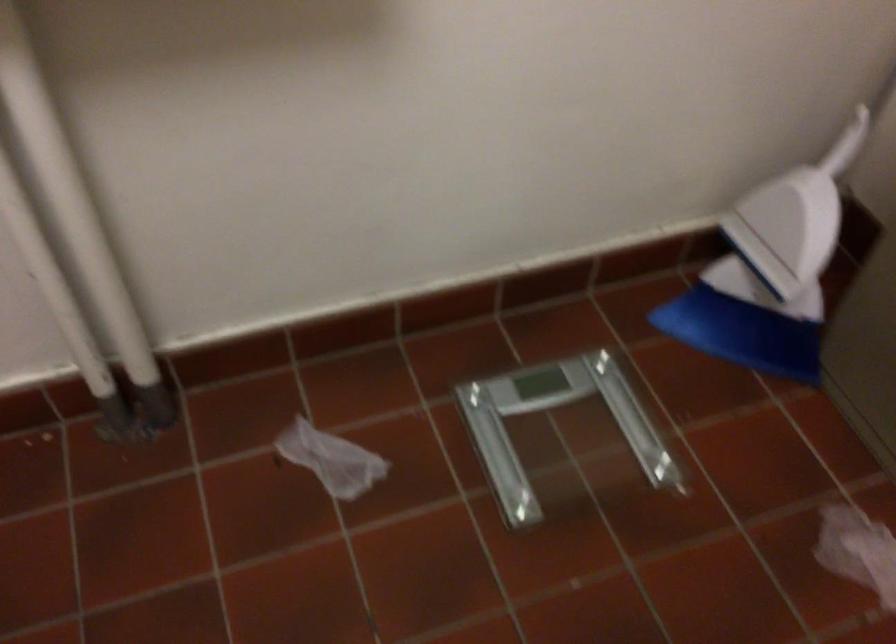
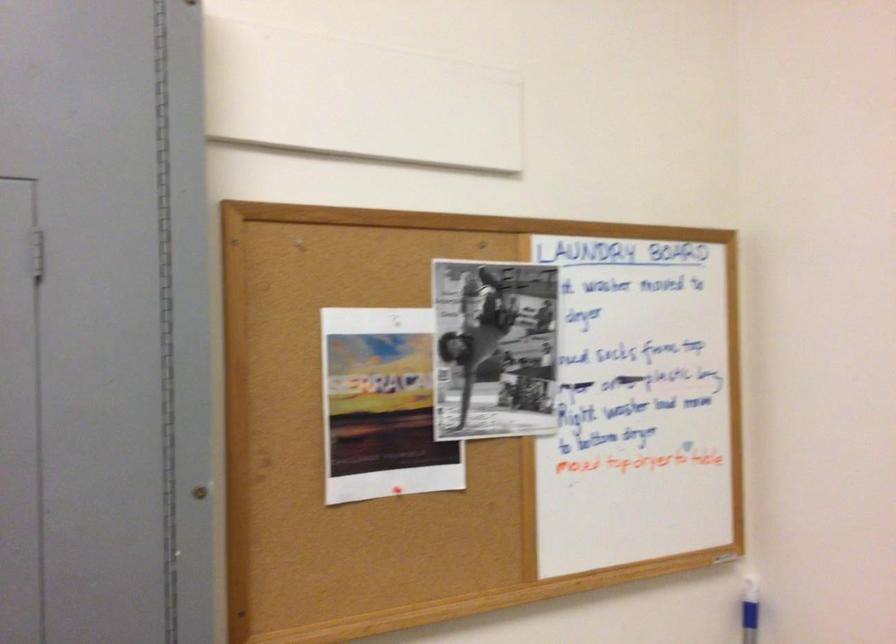
The images are taken continuously from a first-person perspective. In which direction is your viewpoint rotating?

The rotation direction of the camera is right-down.